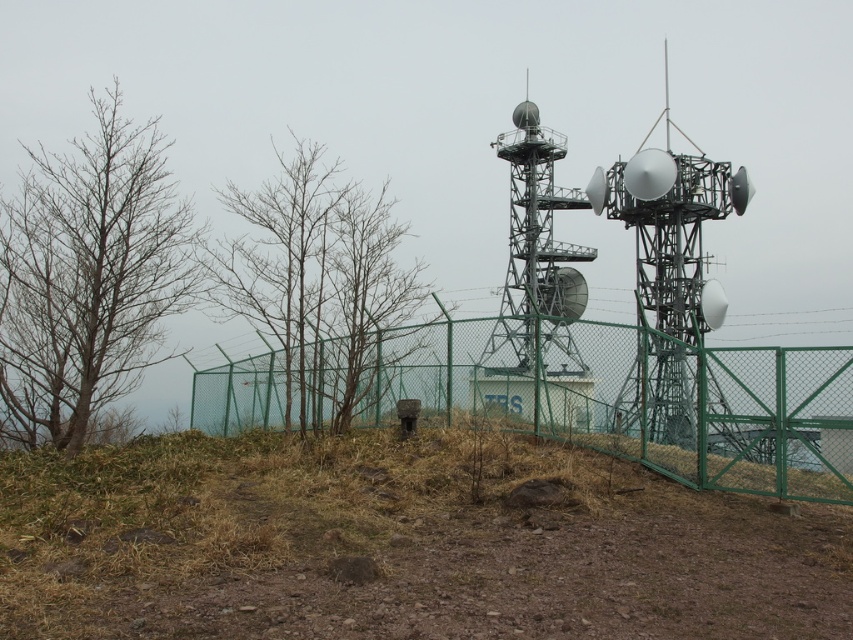
You are standing at the base of the communication tower and want to place a new antenna between the two points marked as point (109, 224) and point (351, 321). Which point is closer to you, and thus better for installing the antenna for easier access?

Point (109, 224) is closer to the viewer than point (351, 321), so it is better for installing the antenna for easier access.

You are standing at the base of the communication tower and looking towards the left side. You see a bare wood tree at left and bare branches at left. Which of these is closer to you?

The bare wood tree at left is closer to you because it is in front of the bare branches at left.